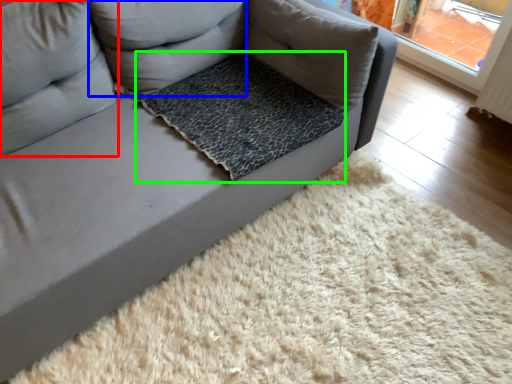
Question: Which object is the closest to the pillow (highlighted by a red box)? Choose among these: pillow (highlighted by a blue box) or dog bed (highlighted by a green box).

Choices:
 (A) pillow
 (B) dog bed

Answer: (A)